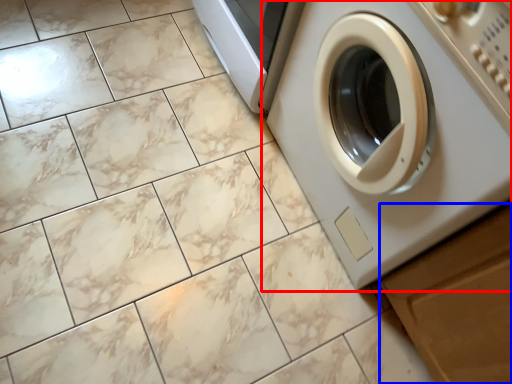
Question: Which object appears farthest to the camera in this image, washing machine (highlighted by a red box) or drawer (highlighted by a blue box)?

Choices:
 (A) washing machine
 (B) drawer

Answer: (B)